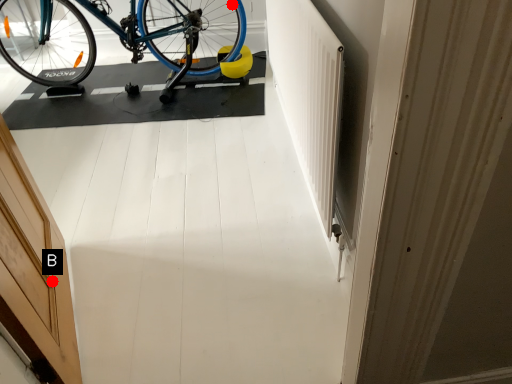
Question: Two points are circled on the image, labeled by A and B beside each circle. Which point is closer to the camera taking this photo?

Choices:
 (A) A is closer
 (B) B is closer

Answer: (B)